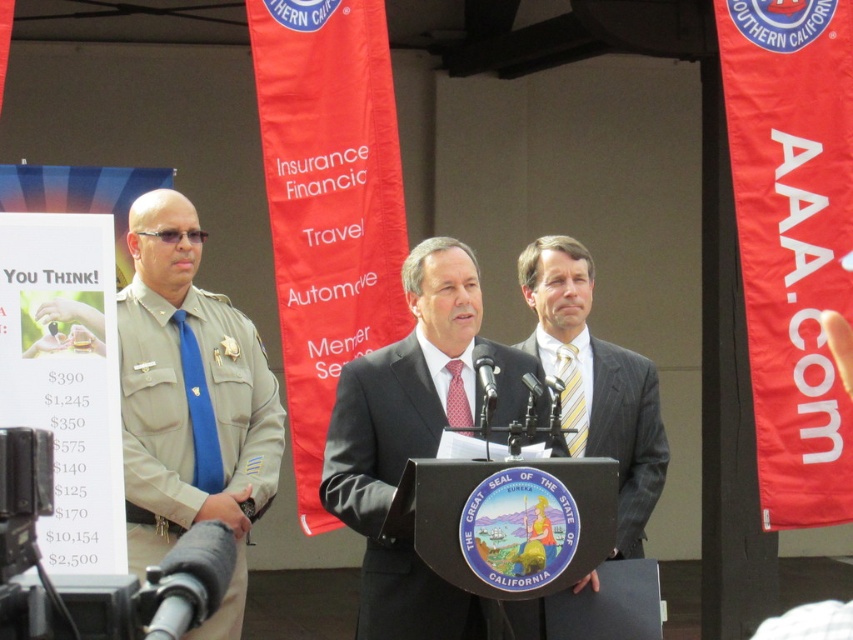
Between yellow striped tie at center and red dotted tie at center, which one has more height?

yellow striped tie at center is taller.

Which is below, yellow striped tie at center or red dotted tie at center?

yellow striped tie at center is below.

Who is more distant from viewer, (x=578, y=452) or (x=457, y=378)?

Positioned behind is point (x=578, y=452).

The height and width of the screenshot is (640, 853). In order to click on yellow striped tie at center in this screenshot , I will do `click(572, 400)`.

Which is above, matte black suit at center or yellow striped tie at center?

Positioned higher is yellow striped tie at center.

Is point (486, 620) positioned before point (579, 388)?

Yes, it is in front of point (579, 388).

What do you see at coordinates (415, 444) in the screenshot? I see `matte black suit at center` at bounding box center [415, 444].

The width and height of the screenshot is (853, 640). In order to click on matte black suit at center in this screenshot , I will do `click(415, 444)`.

Between blue silk tie at left and yellow striped tie at center, which one is positioned higher?

yellow striped tie at center

Between blue silk tie at left and yellow striped tie at center, which one is positioned lower?

blue silk tie at left

Who is more forward, (194, 404) or (560, 397)?

Positioned in front is point (560, 397).

Where is `blue silk tie at left`? The height and width of the screenshot is (640, 853). blue silk tie at left is located at coordinates (199, 410).